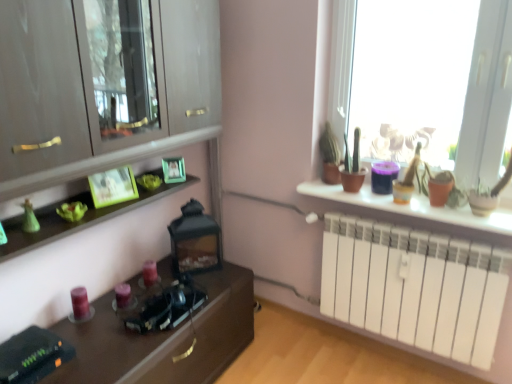
Question: From the image's perspective, is matte wood cabinet at left beneath matte green picture frame at center, the 2th picture frame viewed from the left?

Choices:
 (A) yes
 (B) no

Answer: (B)

Question: Is matte wood cabinet at left facing towards matte green picture frame at center, the 2th picture frame when ordered from front to back?

Choices:
 (A) no
 (B) yes

Answer: (A)

Question: Considering the relative sizes of matte wood cabinet at left and matte green picture frame at center, the first picture frame in the back-to-front sequence, in the image provided, is matte wood cabinet at left smaller than matte green picture frame at center, the first picture frame in the back-to-front sequence,?

Choices:
 (A) yes
 (B) no

Answer: (B)

Question: Does matte wood cabinet at left come behind matte green picture frame at center, the first picture frame positioned from the right?

Choices:
 (A) yes
 (B) no

Answer: (B)

Question: Can you confirm if matte wood cabinet at left is positioned to the left of matte green picture frame at center, the first picture frame in the back-to-front sequence?

Choices:
 (A) no
 (B) yes

Answer: (B)

Question: Is matte wood cabinet at left facing away from matte green picture frame at center, the 2th picture frame when ordered from front to back?

Choices:
 (A) yes
 (B) no

Answer: (B)

Question: Considering the relative sizes of white matte radiator at right and green matte picture frame at upper left, the second picture frame in the right-to-left sequence, in the image provided, is white matte radiator at right thinner than green matte picture frame at upper left, the second picture frame in the right-to-left sequence,?

Choices:
 (A) no
 (B) yes

Answer: (A)

Question: Does white matte radiator at right appear on the right side of green matte picture frame at upper left, which is the first picture frame from left to right?

Choices:
 (A) no
 (B) yes

Answer: (B)

Question: From a real-world perspective, is white matte radiator at right positioned over green matte picture frame at upper left, acting as the second picture frame starting from the back, based on gravity?

Choices:
 (A) yes
 (B) no

Answer: (B)

Question: From a real-world perspective, is white matte radiator at right located beneath green matte picture frame at upper left, acting as the second picture frame starting from the back?

Choices:
 (A) yes
 (B) no

Answer: (A)

Question: Does white matte radiator at right have a larger size compared to green matte picture frame at upper left, which is the first picture frame from left to right?

Choices:
 (A) yes
 (B) no

Answer: (A)

Question: Is white matte radiator at right oriented away from green matte picture frame at upper left, acting as the second picture frame starting from the back?

Choices:
 (A) no
 (B) yes

Answer: (A)

Question: Is matte white radiator at right not within matte green picture frame at center, the 2th picture frame viewed from the left?

Choices:
 (A) yes
 (B) no

Answer: (A)